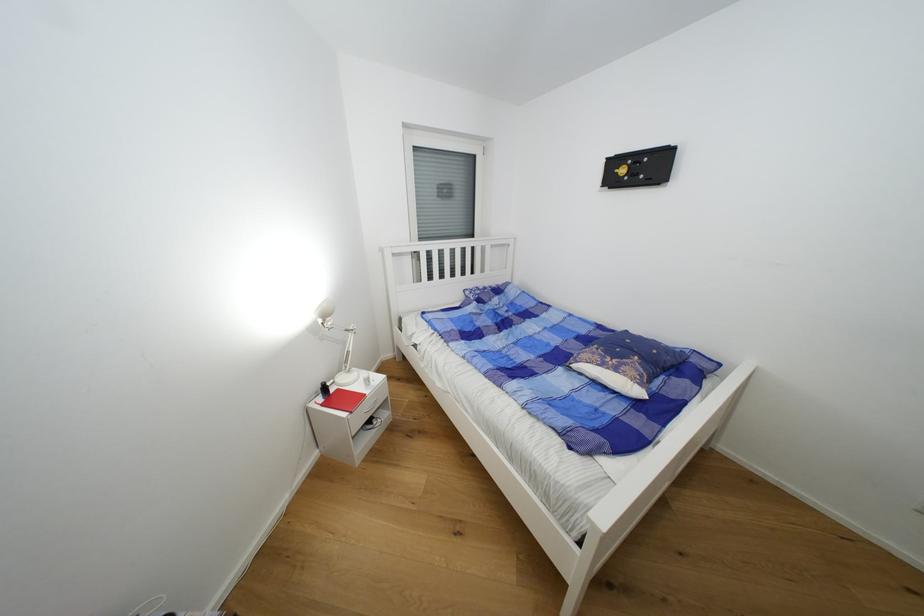
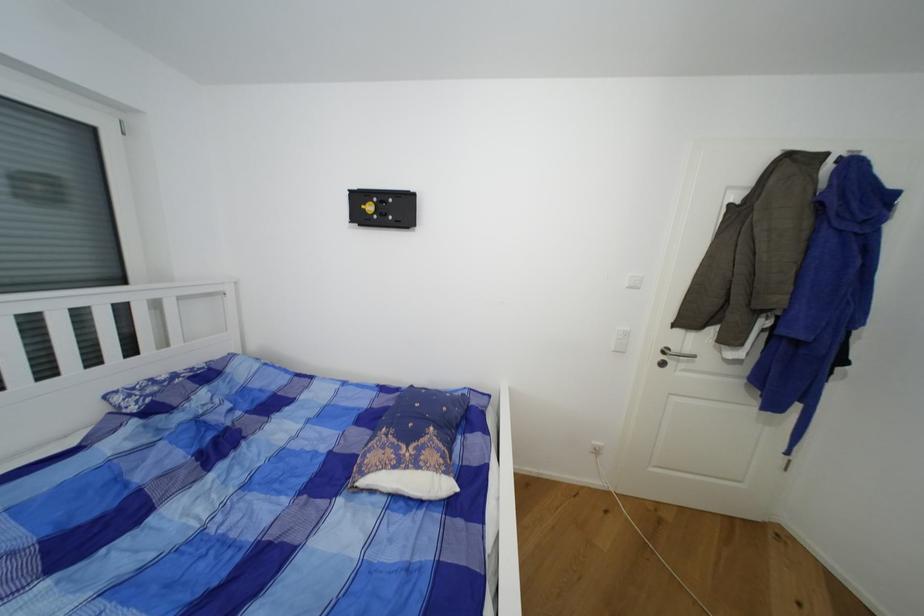
Question: The first image is from the beginning of the video and the second image is from the end. How did the camera likely rotate when shooting the video?

Choices:
 (A) Left
 (B) Right
 (C) Up
 (D) Down

Answer: (B)